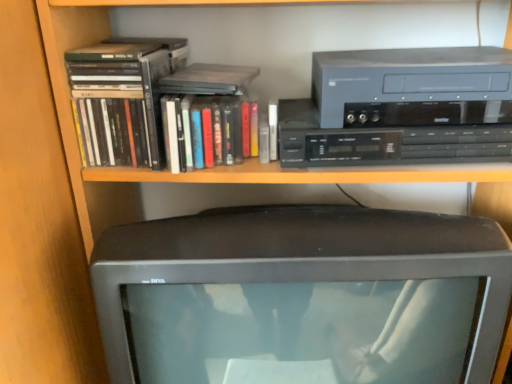
Question: Is matte black book at upper left, which ranks as the 1th book in left-to-right order, smaller than matte gray cassette at upper right, positioned as the second cassette in bottom-to-top order?

Choices:
 (A) no
 (B) yes

Answer: (B)

Question: Is matte black book at upper left, which ranks as the 1th book in left-to-right order, directly adjacent to matte gray cassette at upper right, the first cassette viewed from the top?

Choices:
 (A) yes
 (B) no

Answer: (B)

Question: Can you confirm if matte black book at upper left, the 2th book viewed from the right, is bigger than matte gray cassette at upper right, the first cassette viewed from the top?

Choices:
 (A) yes
 (B) no

Answer: (B)

Question: Is matte black book at upper left, the 2th book viewed from the right, looking in the opposite direction of matte gray cassette at upper right, positioned as the second cassette in bottom-to-top order?

Choices:
 (A) yes
 (B) no

Answer: (B)

Question: From a real-world perspective, is matte black book at upper left, the 2th book viewed from the right, located higher than matte gray cassette at upper right, positioned as the second cassette in bottom-to-top order?

Choices:
 (A) yes
 (B) no

Answer: (B)

Question: From the image's perspective, is matte black monitor at center above or below hardcover book at center, which is the first book from right to left?

Choices:
 (A) below
 (B) above

Answer: (A)

Question: From a real-world perspective, is matte black monitor at center positioned above or below hardcover book at center, which is the first book from right to left?

Choices:
 (A) below
 (B) above

Answer: (A)

Question: Considering the positions of point (362, 231) and point (176, 134), is point (362, 231) closer or farther from the camera than point (176, 134)?

Choices:
 (A) farther
 (B) closer

Answer: (B)

Question: Is matte black monitor at center taller or shorter than hardcover book at center, acting as the second book starting from the left?

Choices:
 (A) tall
 (B) short

Answer: (A)

Question: Considering the positions of hardcover book at center, which is the first book from right to left, and matte gray cassette at upper right, positioned as the second cassette in bottom-to-top order, in the image, is hardcover book at center, which is the first book from right to left, taller or shorter than matte gray cassette at upper right, positioned as the second cassette in bottom-to-top order,?

Choices:
 (A) tall
 (B) short

Answer: (A)

Question: From the image's perspective, is hardcover book at center, acting as the second book starting from the left, above or below matte gray cassette at upper right, the first cassette viewed from the top?

Choices:
 (A) below
 (B) above

Answer: (A)

Question: Visually, is hardcover book at center, which is the first book from right to left, positioned to the left or to the right of matte gray cassette at upper right, positioned as the second cassette in bottom-to-top order?

Choices:
 (A) left
 (B) right

Answer: (A)

Question: Looking at their shapes, would you say hardcover book at center, which is the first book from right to left, is wider or thinner than matte gray cassette at upper right, the first cassette viewed from the top?

Choices:
 (A) wide
 (B) thin

Answer: (B)

Question: Is matte gray cassette at upper right, positioned as the second cassette in bottom-to-top order, in front of or behind matte black book at upper left, the 2th book viewed from the right, in the image?

Choices:
 (A) behind
 (B) front

Answer: (B)

Question: Is matte gray cassette at upper right, the first cassette viewed from the top, spatially inside matte black book at upper left, which ranks as the 1th book in left-to-right order, or outside of it?

Choices:
 (A) inside
 (B) outside

Answer: (B)